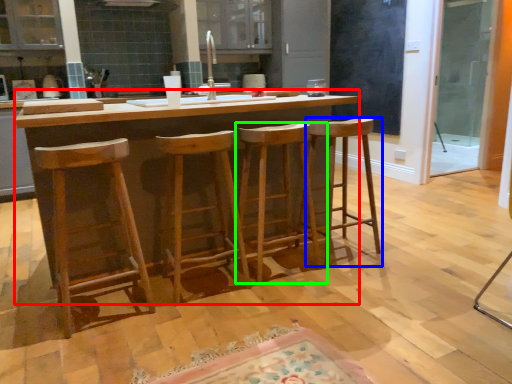
Question: Which is nearer to the table (highlighted by a red box)? stool (highlighted by a blue box) or stool (highlighted by a green box).

Choices:
 (A) stool
 (B) stool

Answer: (B)